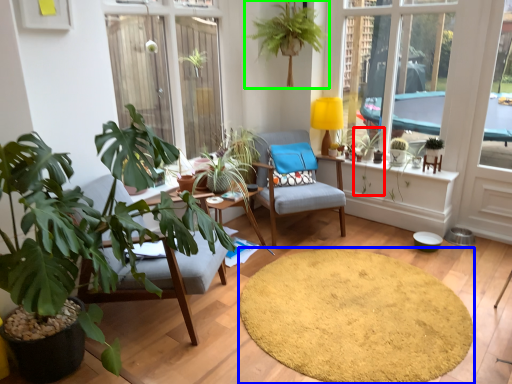
Question: Estimate the real-world distances between objects in this image. Which object is farther from plant (highlighted by a red box), mat (highlighted by a blue box) or houseplant (highlighted by a green box)?

Choices:
 (A) mat
 (B) houseplant

Answer: (A)